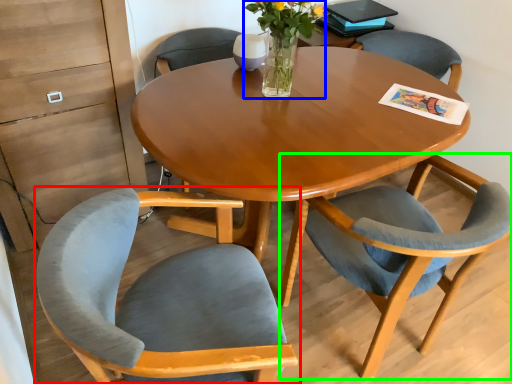
Question: Which is farther away from chair (highlighted by a red box)? floral arrangement (highlighted by a blue box) or chair (highlighted by a green box)?

Choices:
 (A) floral arrangement
 (B) chair

Answer: (A)